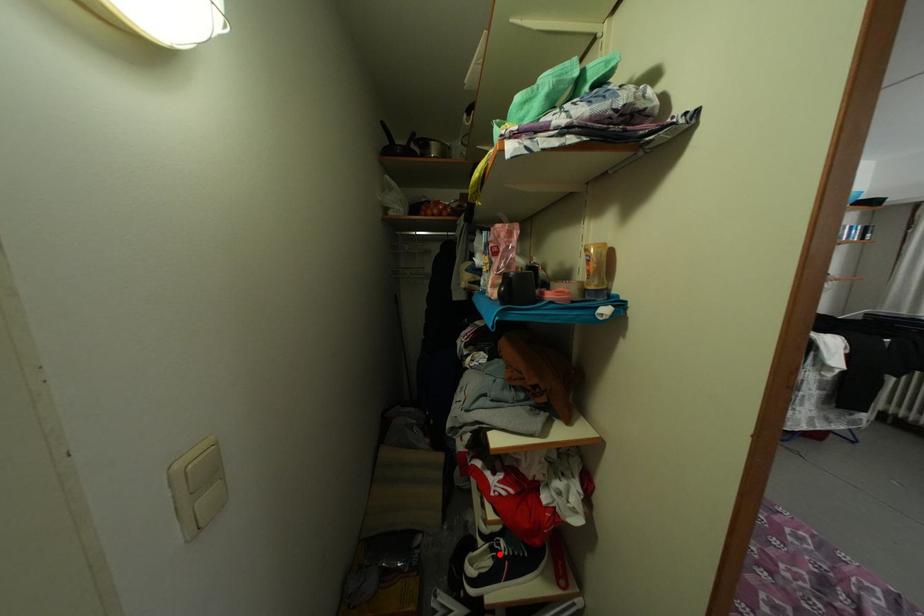
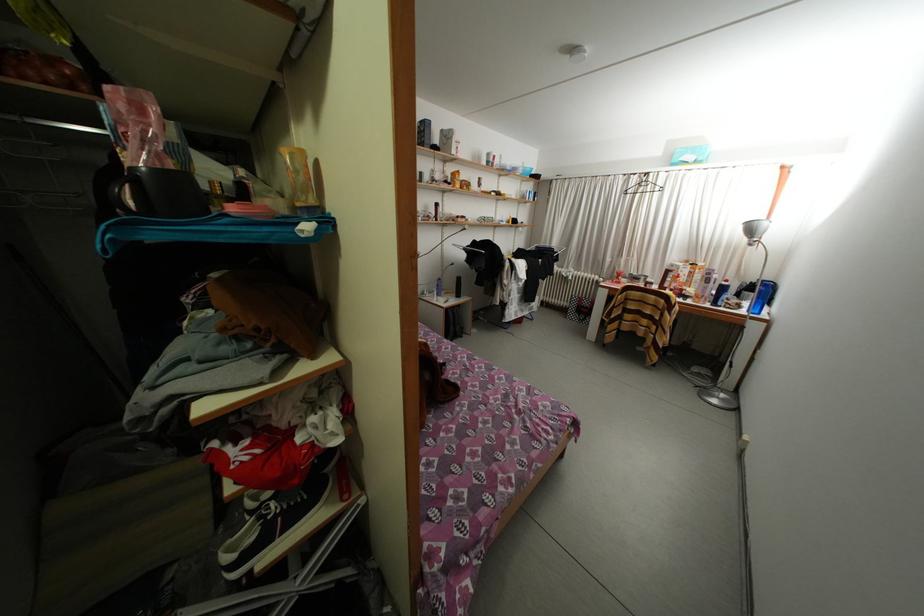
Where in the second image is the point corresponding to the highlighted location from the first image?

(268, 523)